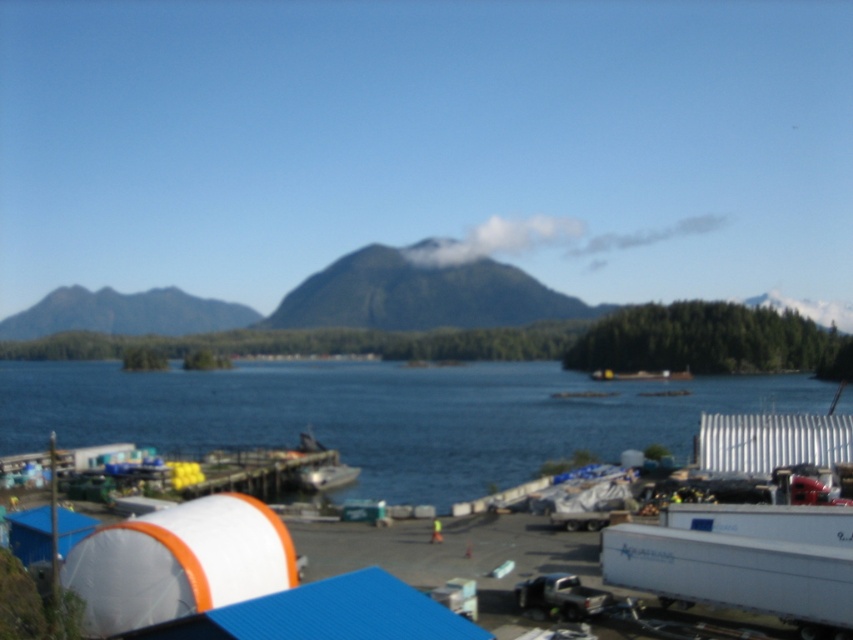
Between point (579, 381) and point (386, 300), which one is positioned behind?

The point (386, 300) is more distant.

At what (x,y) coordinates should I click in order to perform the action: click on blue water at center. Please return your answer as a coordinate pair (x, y). Looking at the image, I should click on (383, 416).

What do you see at coordinates (383, 416) in the screenshot? I see `blue water at center` at bounding box center [383, 416].

Does blue water at center appear on the right side of green textured mountain at upper left?

Yes, blue water at center is to the right of green textured mountain at upper left.

Locate an element on the screen. Image resolution: width=853 pixels, height=640 pixels. blue water at center is located at coordinates (383, 416).

Describe the element at coordinates (421, 292) in the screenshot. The image size is (853, 640). I see `green grassy mountain at center` at that location.

Is green grassy mountain at center taller than green textured mountain at upper left?

Yes.

Image resolution: width=853 pixels, height=640 pixels. What do you see at coordinates (421, 292) in the screenshot? I see `green grassy mountain at center` at bounding box center [421, 292].

This screenshot has width=853, height=640. I want to click on green grassy mountain at center, so click(421, 292).